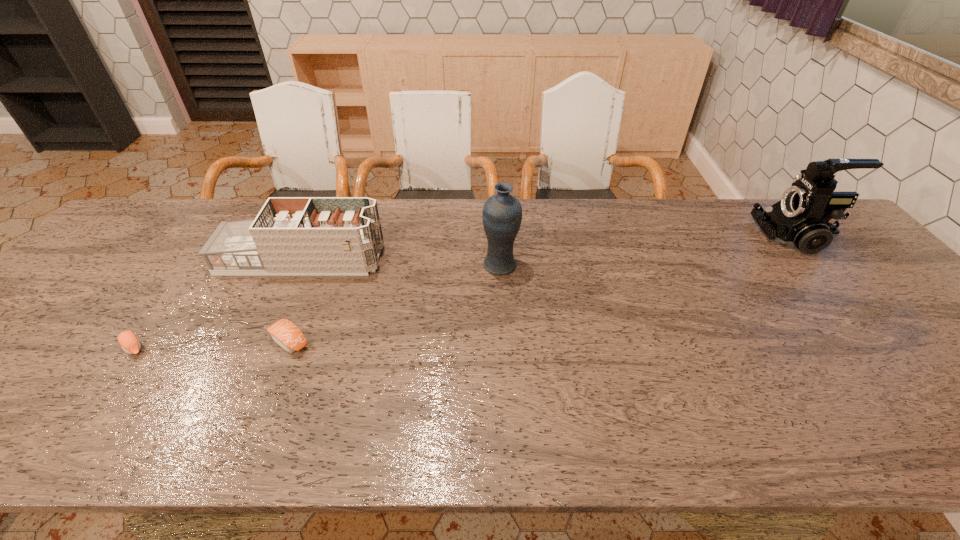
I want to click on vacant space situated on the right of the second object from right to left, so click(x=651, y=266).

Find the location of a particular element. This screenshot has width=960, height=540. vacant area situated 0.160m at the entrance of the third shortest object is located at coordinates (438, 259).

Locate an element on the screen. This screenshot has height=540, width=960. free space located 0.320m on the right of the second shortest object is located at coordinates (448, 341).

Locate an element on the screen. This screenshot has height=540, width=960. free space located 0.280m on the back of the shorter sushi is located at coordinates (197, 260).

The height and width of the screenshot is (540, 960). Identify the location of camcorder that is positioned at the far edge. (803, 219).

Identify the location of dollhouse present at the far edge. (290, 235).

Find the location of a particular element. This screenshot has width=960, height=540. object that is at the right edge is located at coordinates (803, 219).

Identify the location of object present at the far right corner. (803, 219).

Where is `vacant space at the far edge of the desktop`? This screenshot has height=540, width=960. vacant space at the far edge of the desktop is located at coordinates (672, 224).

The height and width of the screenshot is (540, 960). In the image, there is a desktop. Find the location of `vacant space at the near edge`. vacant space at the near edge is located at coordinates (774, 437).